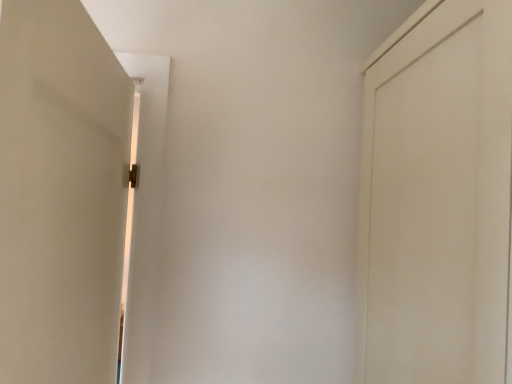
Question: Is white matte door at left, which is the first door in left-to-right order, far away from white matte door at right, which is the 2th door in left-to-right order?

Choices:
 (A) yes
 (B) no

Answer: (B)

Question: Is white matte door at left, which is the first door in left-to-right order, further to the viewer compared to white matte door at right, which is the 2th door in left-to-right order?

Choices:
 (A) no
 (B) yes

Answer: (A)

Question: From a real-world perspective, is white matte door at left, the second door from the right, positioned under white matte door at right, which is the 2th door in left-to-right order, based on gravity?

Choices:
 (A) no
 (B) yes

Answer: (B)

Question: Does white matte door at left, the second door from the right, lie in front of white matte door at right, acting as the 1th door starting from the right?

Choices:
 (A) no
 (B) yes

Answer: (B)

Question: Does white matte door at left, which is the first door in left-to-right order, appear on the right side of white matte door at right, which is the 2th door in left-to-right order?

Choices:
 (A) no
 (B) yes

Answer: (A)

Question: From the image's perspective, is white matte door at left, which is the first door in left-to-right order, over white matte door at right, which is the 2th door in left-to-right order?

Choices:
 (A) no
 (B) yes

Answer: (A)

Question: Is white matte door at right, which is the 2th door in left-to-right order, aimed at white matte door at left, which is the first door in left-to-right order?

Choices:
 (A) no
 (B) yes

Answer: (B)

Question: Is white matte door at left, which is the first door in left-to-right order, completely or partially inside white matte door at right, acting as the 1th door starting from the right?

Choices:
 (A) yes
 (B) no

Answer: (B)

Question: Can you confirm if white matte door at right, acting as the 1th door starting from the right, is bigger than white matte door at left, the second door from the right?

Choices:
 (A) yes
 (B) no

Answer: (A)

Question: Is white matte door at right, which is the 2th door in left-to-right order, at the right side of white matte door at left, the second door from the right?

Choices:
 (A) no
 (B) yes

Answer: (B)

Question: Considering the relative sizes of white matte door at right, acting as the 1th door starting from the right, and white matte door at left, the second door from the right, in the image provided, is white matte door at right, acting as the 1th door starting from the right, thinner than white matte door at left, the second door from the right,?

Choices:
 (A) no
 (B) yes

Answer: (A)

Question: From a real-world perspective, is white matte door at right, which is the 2th door in left-to-right order, located beneath white matte door at left, which is the first door in left-to-right order?

Choices:
 (A) no
 (B) yes

Answer: (A)

Question: From the image's perspective, is white matte door at left, the second door from the right, above or below white matte door at right, acting as the 1th door starting from the right?

Choices:
 (A) below
 (B) above

Answer: (A)